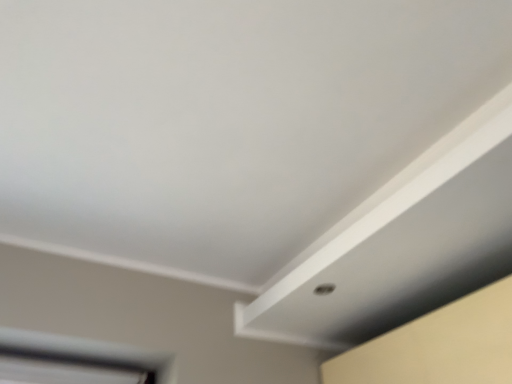
Question: From a real-world perspective, is white plastic window at lower left under white matte exhaust hood at center?

Choices:
 (A) yes
 (B) no

Answer: (A)

Question: Can you confirm if white plastic window at lower left is taller than white matte exhaust hood at center?

Choices:
 (A) no
 (B) yes

Answer: (A)

Question: Is white plastic window at lower left positioned in front of white matte exhaust hood at center?

Choices:
 (A) no
 (B) yes

Answer: (A)

Question: Is white plastic window at lower left positioned far away from white matte exhaust hood at center?

Choices:
 (A) yes
 (B) no

Answer: (B)

Question: Can you confirm if white plastic window at lower left is thinner than white matte exhaust hood at center?

Choices:
 (A) no
 (B) yes

Answer: (B)

Question: Considering the relative positions of white plastic window at lower left and white matte exhaust hood at center in the image provided, is white plastic window at lower left to the left of white matte exhaust hood at center from the viewer's perspective?

Choices:
 (A) yes
 (B) no

Answer: (A)

Question: From the image's perspective, is white matte exhaust hood at center over white plastic window at lower left?

Choices:
 (A) no
 (B) yes

Answer: (B)

Question: Is white plastic window at lower left a part of white matte exhaust hood at center?

Choices:
 (A) yes
 (B) no

Answer: (B)

Question: From a real-world perspective, is white matte exhaust hood at center physically above white plastic window at lower left?

Choices:
 (A) yes
 (B) no

Answer: (A)

Question: Is white matte exhaust hood at center taller than white plastic window at lower left?

Choices:
 (A) no
 (B) yes

Answer: (B)

Question: Is white matte exhaust hood at center further to the viewer compared to white plastic window at lower left?

Choices:
 (A) yes
 (B) no

Answer: (B)

Question: Is white matte exhaust hood at center to the left of white plastic window at lower left from the viewer's perspective?

Choices:
 (A) yes
 (B) no

Answer: (B)

Question: From a real-world perspective, is white matte exhaust hood at center physically located above or below white plastic window at lower left?

Choices:
 (A) below
 (B) above

Answer: (B)